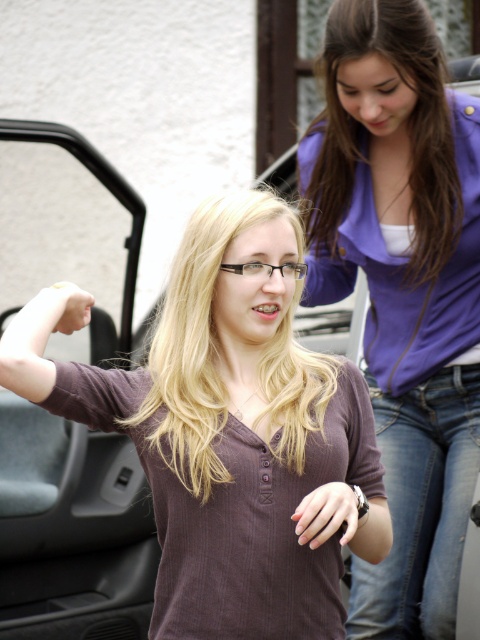
Does purple soft fabric jacket at upper right appear on the left side of gray fabric car door at left?

In fact, purple soft fabric jacket at upper right is to the right of gray fabric car door at left.

Is purple soft fabric jacket at upper right above gray fabric car door at left?

Indeed, purple soft fabric jacket at upper right is positioned over gray fabric car door at left.

Between point (312, 252) and point (84, 449), which one is positioned behind?

The point (84, 449) is more distant.

In order to click on purple soft fabric jacket at upper right in this screenshot , I will do `click(403, 289)`.

Between brown ribbed shirt at center and gray fabric car door at left, which one appears on the left side from the viewer's perspective?

gray fabric car door at left is more to the left.

Is brown ribbed shirt at center positioned in front of gray fabric car door at left?

Yes.

Which is in front, point (263, 250) or point (26, 600)?

Positioned in front is point (263, 250).

Where is `brown ribbed shirt at center`? The height and width of the screenshot is (640, 480). brown ribbed shirt at center is located at coordinates (229, 429).

Does point (349, 170) come in front of point (190, 397)?

No, (349, 170) is behind (190, 397).

In order to click on purple soft fabric jacket at upper right in this screenshot , I will do `click(403, 289)`.

Between point (444, 392) and point (217, 380), which one is positioned behind?

The point (444, 392) is behind.

The height and width of the screenshot is (640, 480). In order to click on purple soft fabric jacket at upper right in this screenshot , I will do `click(403, 289)`.